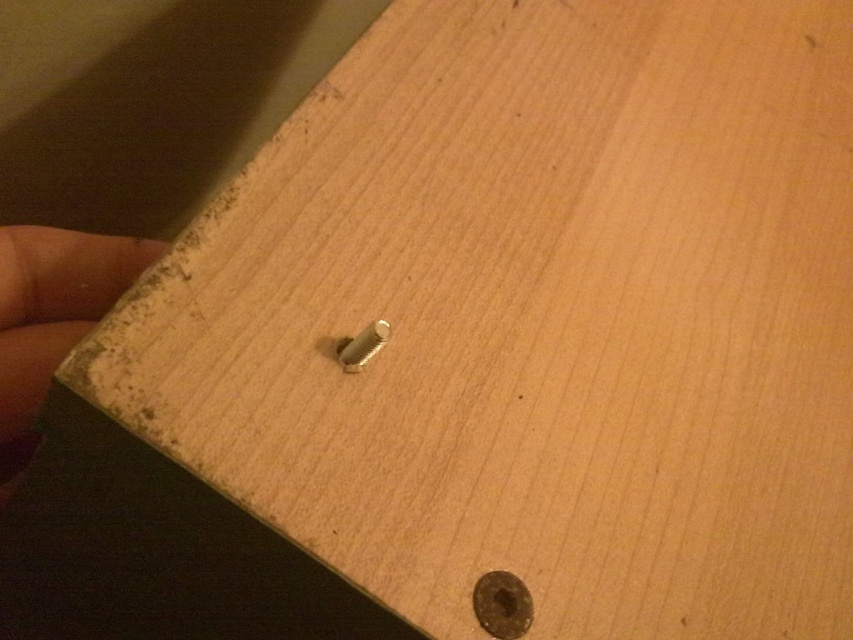
Is brown leather hand at left smaller than gold metallic bolt at center?

No.

Can you confirm if brown leather hand at left is bigger than gold metallic bolt at center?

Yes, brown leather hand at left is bigger than gold metallic bolt at center.

Between point (9, 349) and point (497, 602), which one is positioned behind?

Point (9, 349)

Identify the location of brown leather hand at left. (51, 316).

At what (x,y) coordinates should I click in order to perform the action: click on gold metallic bolt at center. Please return your answer as a coordinate pair (x, y). The width and height of the screenshot is (853, 640). Looking at the image, I should click on (502, 604).

Can you confirm if gold metallic bolt at center is positioned to the right of silver metallic bolt at center?

Yes, gold metallic bolt at center is to the right of silver metallic bolt at center.

Is point (490, 609) less distant than point (361, 337)?

Yes, point (490, 609) is in front of point (361, 337).

Identify the location of gold metallic bolt at center. (502, 604).

Between brown leather hand at left and silver metallic bolt at center, which one appears on the left side from the viewer's perspective?

From the viewer's perspective, brown leather hand at left appears more on the left side.

Which is above, brown leather hand at left or silver metallic bolt at center?

silver metallic bolt at center is above.

The height and width of the screenshot is (640, 853). Identify the location of brown leather hand at left. (51, 316).

Where is `brown leather hand at left`? brown leather hand at left is located at coordinates (51, 316).